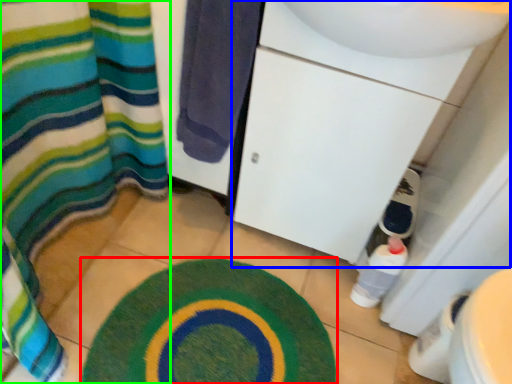
Question: Which is farther away from bath mat (highlighted by a red box)? sink (highlighted by a blue box) or curtain (highlighted by a green box)?

Choices:
 (A) sink
 (B) curtain

Answer: (A)